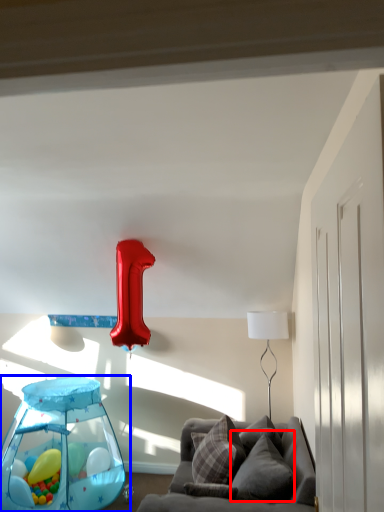
Question: Which object is closer to the camera taking this photo, pillow (highlighted by a red box) or baby carriage (highlighted by a blue box)?

Choices:
 (A) pillow
 (B) baby carriage

Answer: (A)